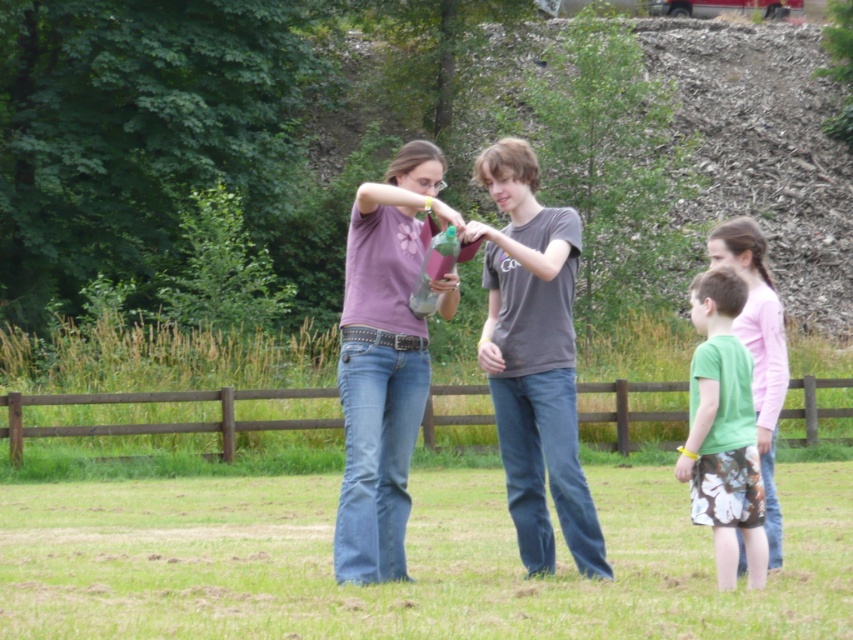
Measure the distance between matte purple shirt at center and translucent plastic bottle at center.

matte purple shirt at center is 11.23 inches from translucent plastic bottle at center.

Does point (358, 278) come farther from viewer compared to point (432, 296)?

Yes, point (358, 278) is farther from viewer.

At what (x,y) coordinates should I click in order to perform the action: click on matte purple shirt at center. Please return your answer as a coordinate pair (x, y). The height and width of the screenshot is (640, 853). Looking at the image, I should click on (383, 360).

At what (x,y) coordinates should I click in order to perform the action: click on matte purple shirt at center. Please return your answer as a coordinate pair (x, y). The image size is (853, 640). Looking at the image, I should click on (383, 360).

The image size is (853, 640). Identify the location of matte purple shirt at center. (383, 360).

Based on the photo, does matte purple shirt at center appear under green fabric shorts at lower right?

Incorrect, matte purple shirt at center is not positioned below green fabric shorts at lower right.

Which is behind, point (422, 177) or point (755, 451)?

Positioned behind is point (422, 177).

The height and width of the screenshot is (640, 853). Identify the location of matte purple shirt at center. (383, 360).

Who is lower down, pink fabric shirt at right or translucent plastic bottle at center?

translucent plastic bottle at center is lower down.

Is point (770, 356) positioned in front of point (416, 289)?

No, (770, 356) is further to viewer.

This screenshot has width=853, height=640. Describe the element at coordinates (758, 349) in the screenshot. I see `pink fabric shirt at right` at that location.

In order to click on pink fabric shirt at right in this screenshot , I will do `click(758, 349)`.